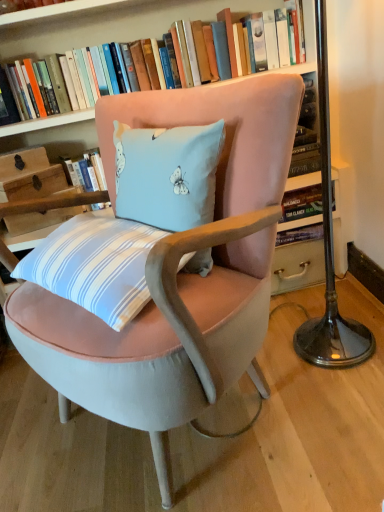
Question: From the image's perspective, is velvet pink chair at center under metallic base at right?

Choices:
 (A) yes
 (B) no

Answer: (A)

Question: Considering the relative positions of velvet pink chair at center and metallic base at right in the image provided, is velvet pink chair at center behind metallic base at right?

Choices:
 (A) no
 (B) yes

Answer: (A)

Question: Does velvet pink chair at center appear on the left side of metallic base at right?

Choices:
 (A) no
 (B) yes

Answer: (B)

Question: Can you confirm if velvet pink chair at center is smaller than metallic base at right?

Choices:
 (A) no
 (B) yes

Answer: (A)

Question: From a real-world perspective, is velvet pink chair at center under metallic base at right?

Choices:
 (A) yes
 (B) no

Answer: (A)

Question: Considering the relative sizes of velvet pink chair at center and metallic base at right in the image provided, is velvet pink chair at center thinner than metallic base at right?

Choices:
 (A) no
 (B) yes

Answer: (A)

Question: Is velvet pink chair at center facing away from hardcover book at upper center?

Choices:
 (A) no
 (B) yes

Answer: (B)

Question: From a real-world perspective, is velvet pink chair at center on hardcover book at upper center?

Choices:
 (A) no
 (B) yes

Answer: (A)

Question: From a real-world perspective, is velvet pink chair at center below hardcover book at upper center?

Choices:
 (A) yes
 (B) no

Answer: (A)

Question: Is velvet pink chair at center behind hardcover book at upper center?

Choices:
 (A) no
 (B) yes

Answer: (A)

Question: Is velvet pink chair at center bigger than hardcover book at upper center?

Choices:
 (A) yes
 (B) no

Answer: (A)

Question: Considering the relative sizes of velvet pink chair at center and hardcover book at upper center in the image provided, is velvet pink chair at center taller than hardcover book at upper center?

Choices:
 (A) yes
 (B) no

Answer: (A)

Question: Is hardcover book at upper center oriented away from metallic base at right?

Choices:
 (A) yes
 (B) no

Answer: (B)